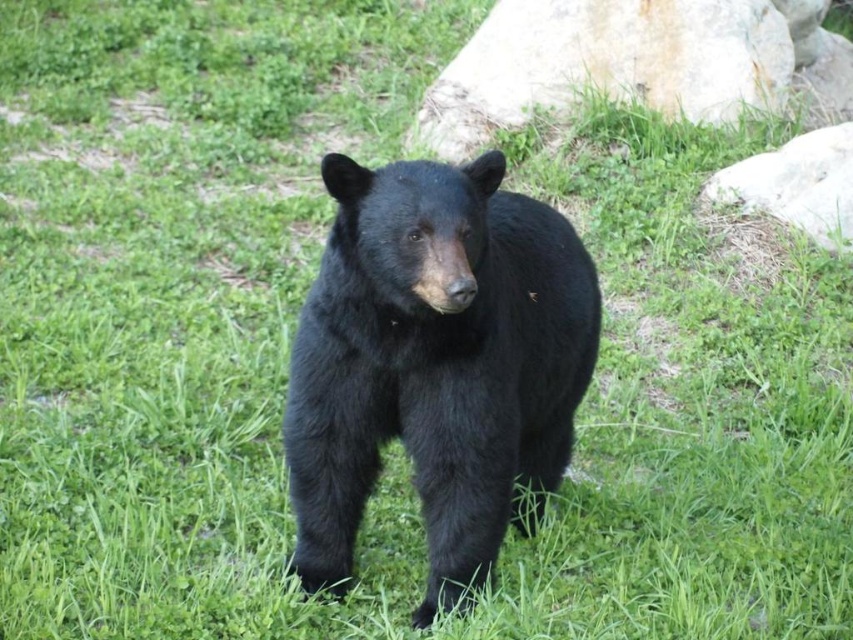
You are a photographer trying to capture the black bear in the scene. You want to position yourself so that the gray rock at upper right and the white smooth rock at right are both visible in the frame. Which rock should you place closer to the left side of your camera viewfinder to ensure both are included?

To include both the gray rock at upper right and the white smooth rock at right in the frame, position the gray rock at upper right on the left side of the viewfinder since it is already to the left of the white smooth rock at right.

What are the coordinates of the black furry bear at center in the image?

The black furry bear at center is located at coordinates point (434, 364).